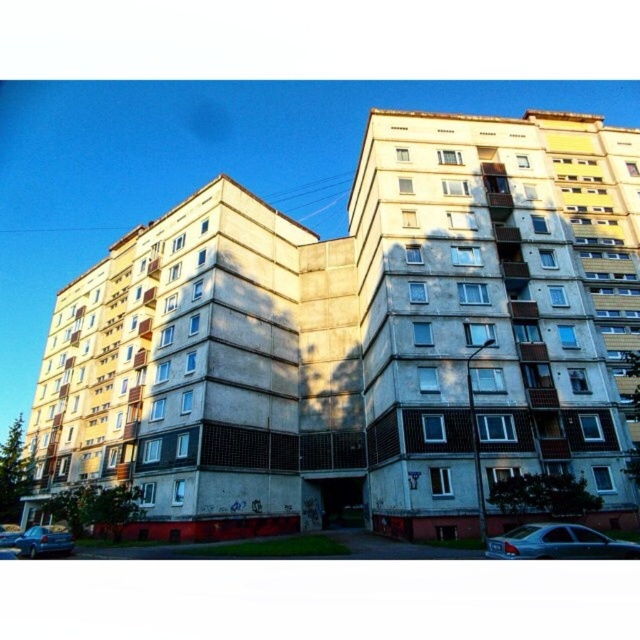
The width and height of the screenshot is (640, 640). Describe the element at coordinates (557, 541) in the screenshot. I see `metallic silver sedan at lower right` at that location.

Identify the location of metallic silver sedan at lower right. The width and height of the screenshot is (640, 640). tap(557, 541).